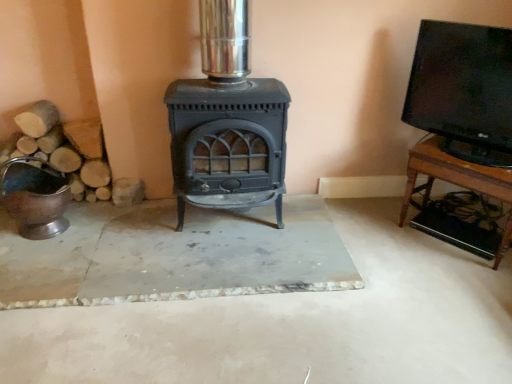
What are the coordinates of `space that is in front of shiny metallic bucket at left` in the screenshot? It's located at (37, 264).